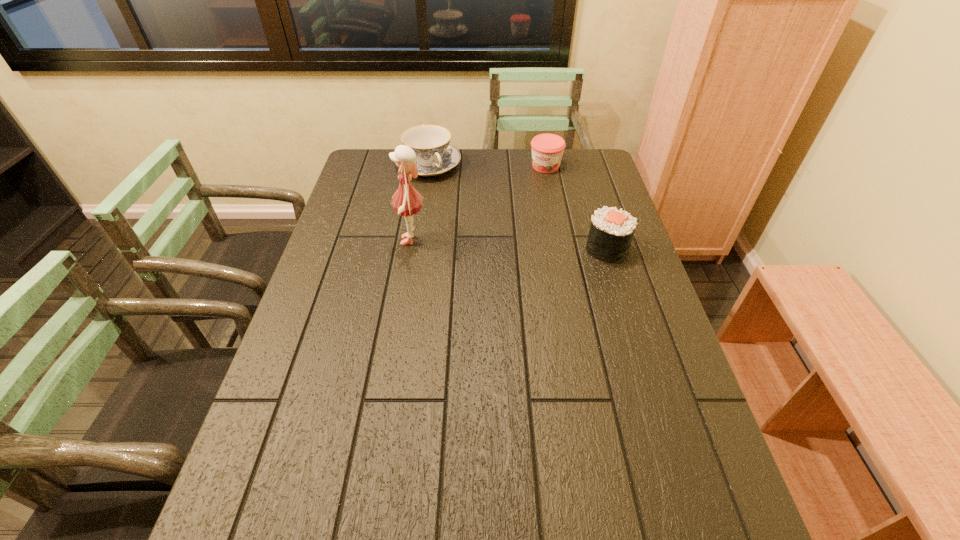
In order to click on the tallest object in this screenshot , I will do `click(407, 201)`.

Where is `the rightmost object`? the rightmost object is located at coordinates (611, 232).

You are a GUI agent. You are given a task and a screenshot of the screen. Output one action in this format:
    pyautogui.click(x=<x>, y=<y>)
    Task: Click on the third object from left to right
    The height and width of the screenshot is (540, 960).
    Given the screenshot: What is the action you would take?
    pyautogui.click(x=547, y=149)

In order to click on jam in this screenshot , I will do `click(547, 149)`.

In order to click on chinaware in this screenshot , I will do `click(434, 155)`.

At what (x,y) coordinates should I click in order to perform the action: click on vacant space positioned on the front-facing side of the tallest object. Please return your answer as a coordinate pair (x, y). This screenshot has width=960, height=540. Looking at the image, I should click on (335, 240).

Identify the location of vacant space located 0.110m on the front-facing side of the tallest object. The width and height of the screenshot is (960, 540). (361, 240).

In order to click on vacant space located on the front-facing side of the tallest object in this screenshot , I will do `click(342, 240)`.

Where is `vacant area situated on the back of the sushi`? The height and width of the screenshot is (540, 960). vacant area situated on the back of the sushi is located at coordinates (584, 172).

Where is `free space located on the front label of the shortest object`? The height and width of the screenshot is (540, 960). free space located on the front label of the shortest object is located at coordinates (515, 222).